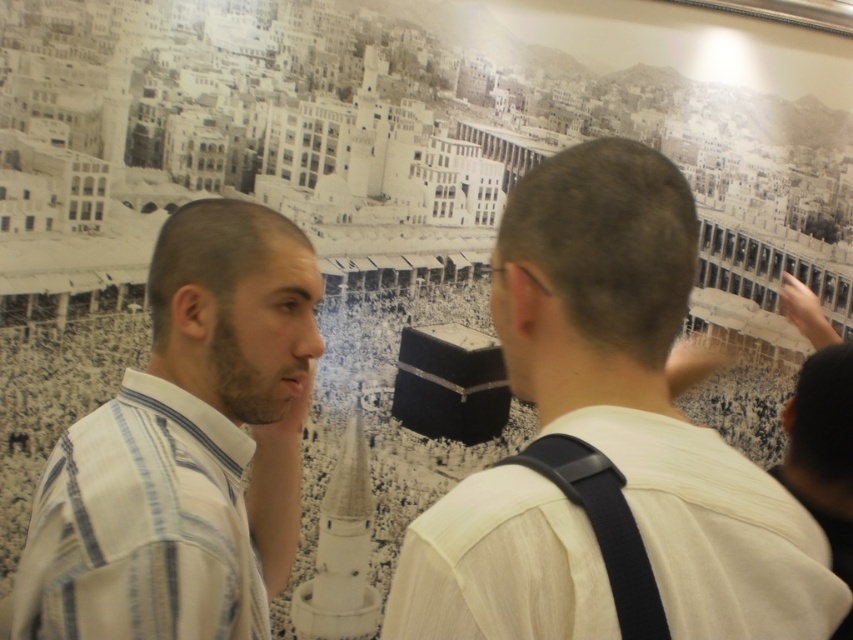
Question: Does white shirt at center appear under white striped shirt at center?

Choices:
 (A) no
 (B) yes

Answer: (A)

Question: Which of the following is the closest to the observer?

Choices:
 (A) (27, 598)
 (B) (660, 540)

Answer: (B)

Question: Can you confirm if white shirt at center is wider than white striped shirt at center?

Choices:
 (A) no
 (B) yes

Answer: (B)

Question: Does white shirt at center have a larger size compared to white striped shirt at center?

Choices:
 (A) no
 (B) yes

Answer: (B)

Question: Which point is closer to the camera?

Choices:
 (A) (225, 284)
 (B) (569, 609)

Answer: (B)